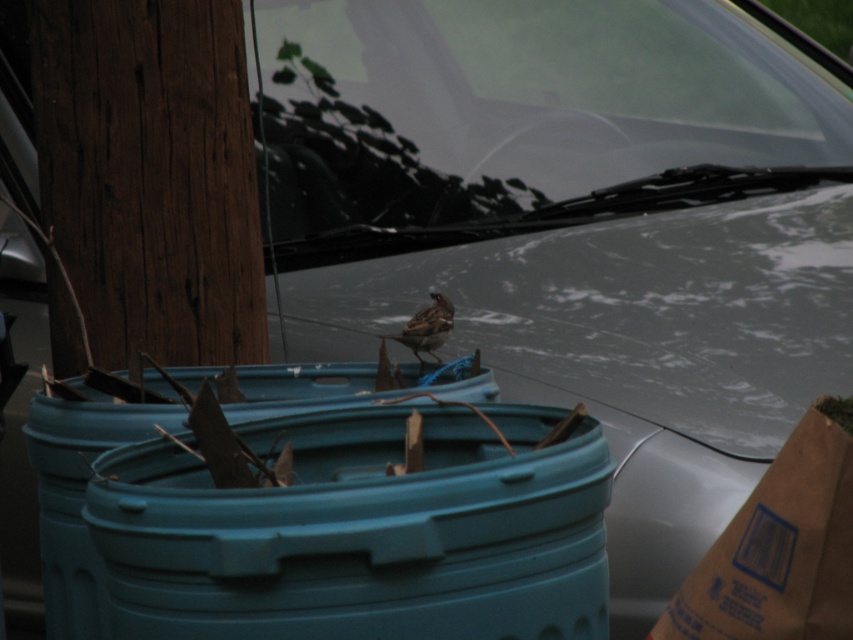
Which is in front, point (579, 124) or point (438, 317)?

Point (438, 317) is in front.

Does clear glass windshield at upper center lie behind brown speckled sparrow at center?

Yes, it is.

Who is more distant from viewer, [622,141] or [440,300]?

Positioned behind is point [622,141].

This screenshot has height=640, width=853. What are the coordinates of `clear glass windshield at upper center` in the screenshot? It's located at (x=521, y=116).

Between clear glass windshield at upper center and brown paper bag at upper right, which one has more height?

clear glass windshield at upper center

Does clear glass windshield at upper center lie in front of brown paper bag at upper right?

That is False.

Which is behind, point (397, 186) or point (772, 509)?

The point (397, 186) is behind.

Locate an element on the screen. The image size is (853, 640). clear glass windshield at upper center is located at coordinates (521, 116).

Which is behind, point (729, 536) or point (436, 358)?

The point (436, 358) is more distant.

Is point (787, 444) farther from viewer compared to point (416, 358)?

That is True.

Describe the element at coordinates (780, 547) in the screenshot. I see `brown paper bag at upper right` at that location.

I want to click on brown paper bag at upper right, so click(780, 547).